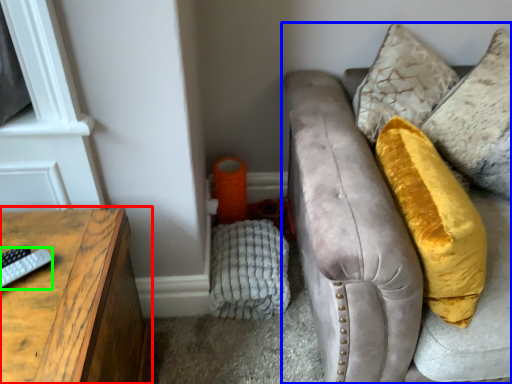
Question: Estimate the real-world distances between objects in this image. Which object is farther from table (highlighted by a red box), studio couch (highlighted by a blue box) or remote (highlighted by a green box)?

Choices:
 (A) studio couch
 (B) remote

Answer: (A)